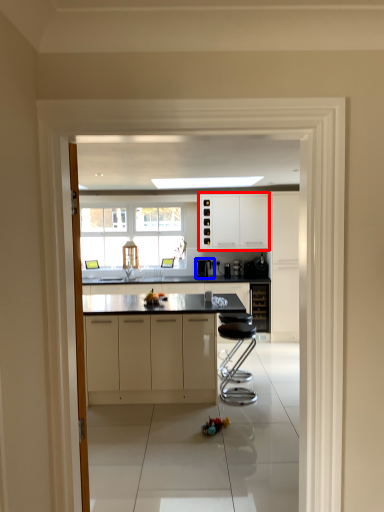
Question: Which of the following is the farthest to the observer, cabinetry (highlighted by a red box) or appliance (highlighted by a blue box)?

Choices:
 (A) cabinetry
 (B) appliance

Answer: (B)